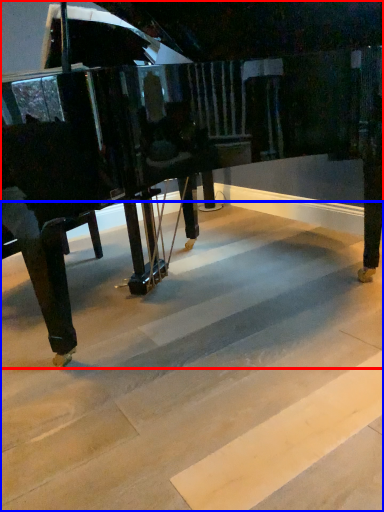
Question: Which point is closer to the camera, piano (highlighted by a red box) or stair (highlighted by a blue box)?

Choices:
 (A) piano
 (B) stair

Answer: (B)